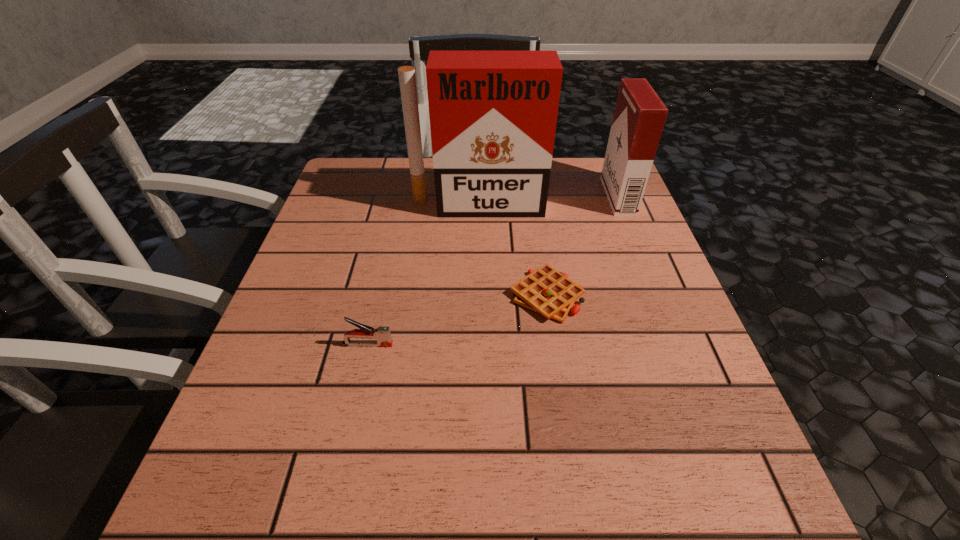
I want to click on the left cigarette_case, so click(x=493, y=114).

This screenshot has width=960, height=540. I want to click on the tallest object, so (493, 114).

I want to click on the third shortest object, so click(x=639, y=116).

Where is `the right cigarette_case`? This screenshot has width=960, height=540. the right cigarette_case is located at coordinates (639, 116).

Identify the location of the second shortest object. The height and width of the screenshot is (540, 960). (382, 334).

Identify the location of stapler. (382, 334).

Identify the location of the shortest object. (546, 291).

Find the location of a particular element. waffle is located at coordinates (546, 291).

Find the location of a particular element. The width and height of the screenshot is (960, 540). vacant space located on the front-facing side of the tallest object is located at coordinates (477, 344).

Find the location of a particular element. The width and height of the screenshot is (960, 540). free space located 0.070m on the front-facing side of the right cigarette_case is located at coordinates (580, 196).